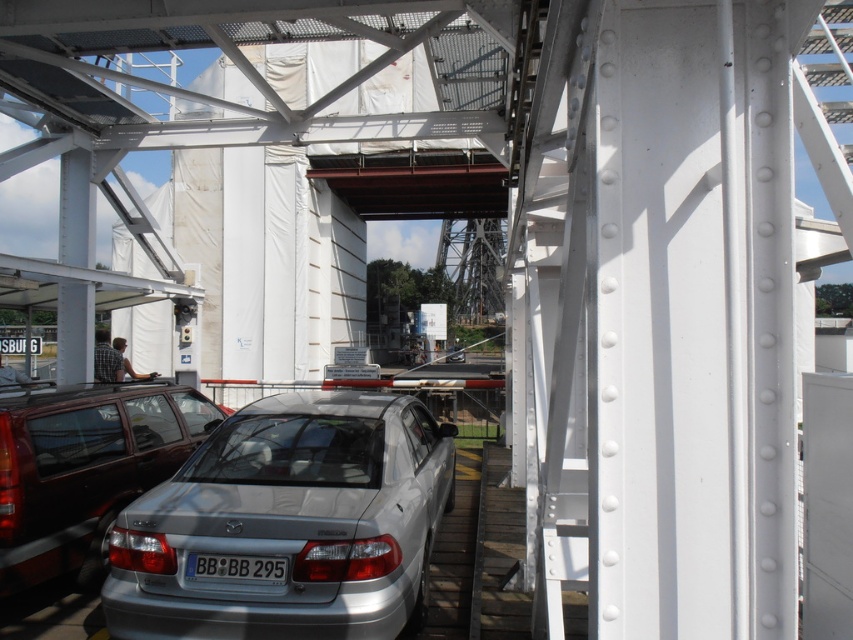
You are a delivery driver who needs to park your truck next to the satin silver sedan at lower center. The parking area has a coordinate system where the bottom left corner is the origin. Can you park your truck at coordinates closer than 0.5 units from the sedan?

The satin silver sedan at lower center is located at point (85, 468). To park your truck closer than 0.5 units from the sedan, you can position it within a radius of 0.5 units from these coordinates, ensuring it stays within the parking area boundaries.

You are a delivery driver who needs to park your car under the industrial structure. You see the silver metallic car at center and the white plastic license plate at center. Which object is positioned higher from the ground?

The silver metallic car at center is above the white plastic license plate at center, so the silver metallic car at center is positioned higher from the ground.